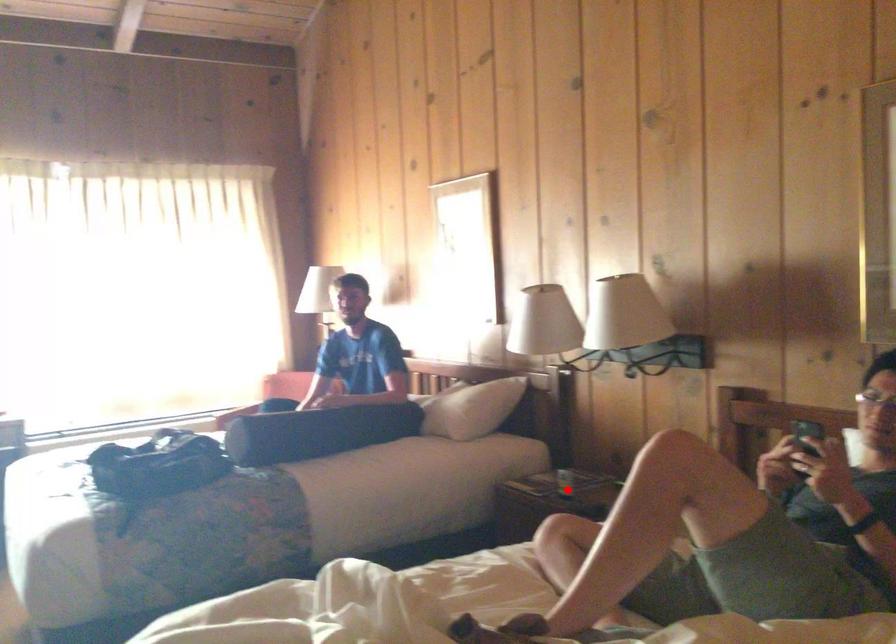
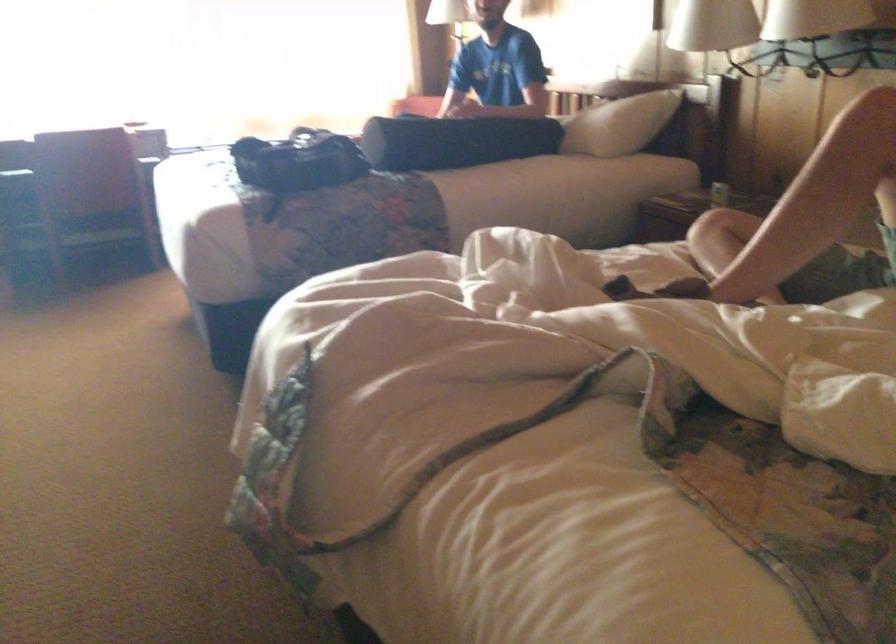
Question: A red point is marked in image1. In image2, is the corresponding 3D point closer to the camera or farther? Reply with the corresponding letter.

Choices:
 (A) The corresponding 3D point is closer.
 (B) The corresponding 3D point is farther.

Answer: (A)